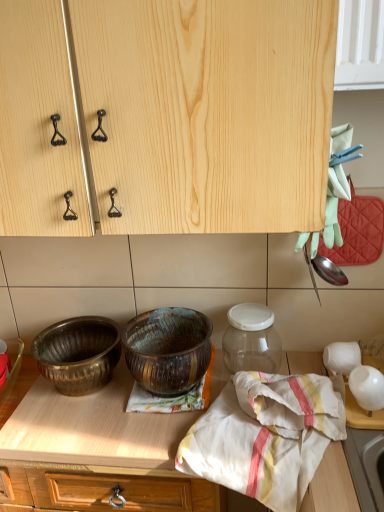
Question: Is polished brass bowl at lower left, which is the second bowl from right to left, at the left side of white cotton cloth at center?

Choices:
 (A) yes
 (B) no

Answer: (A)

Question: Considering the relative sizes of polished brass bowl at lower left, which is counted as the first bowl, starting from the left, and white cotton cloth at center in the image provided, is polished brass bowl at lower left, which is counted as the first bowl, starting from the left, taller than white cotton cloth at center?

Choices:
 (A) no
 (B) yes

Answer: (A)

Question: Is white cotton cloth at center at the back of polished brass bowl at lower left, which is the second bowl from right to left?

Choices:
 (A) yes
 (B) no

Answer: (B)

Question: Is there a large distance between polished brass bowl at lower left, which is the second bowl from right to left, and white cotton cloth at center?

Choices:
 (A) yes
 (B) no

Answer: (B)

Question: Can you confirm if polished brass bowl at lower left, which is counted as the first bowl, starting from the left, is wider than white cotton cloth at center?

Choices:
 (A) no
 (B) yes

Answer: (A)

Question: Does polished brass bowl at lower left, which is the second bowl from right to left, come behind white cotton cloth at center?

Choices:
 (A) yes
 (B) no

Answer: (A)

Question: Is polished brass bowl at lower left, which is the second bowl from right to left, to the right of wooden at center from the viewer's perspective?

Choices:
 (A) no
 (B) yes

Answer: (B)

Question: Is polished brass bowl at lower left, which is counted as the first bowl, starting from the left, placed right next to wooden at center?

Choices:
 (A) yes
 (B) no

Answer: (B)

Question: Does polished brass bowl at lower left, which is counted as the first bowl, starting from the left, have a lesser height compared to wooden at center?

Choices:
 (A) yes
 (B) no

Answer: (A)

Question: Does polished brass bowl at lower left, which is the second bowl from right to left, have a lesser width compared to wooden at center?

Choices:
 (A) yes
 (B) no

Answer: (A)

Question: Is polished brass bowl at lower left, which is the second bowl from right to left, to the left of wooden at center from the viewer's perspective?

Choices:
 (A) yes
 (B) no

Answer: (B)

Question: From a real-world perspective, does polished brass bowl at lower left, which is counted as the first bowl, starting from the left, stand above wooden at center?

Choices:
 (A) no
 (B) yes

Answer: (B)

Question: Is rusty metallic bowl at center, placed as the 2th bowl when sorted from left to right, further to camera compared to white cotton cloth at center?

Choices:
 (A) yes
 (B) no

Answer: (A)